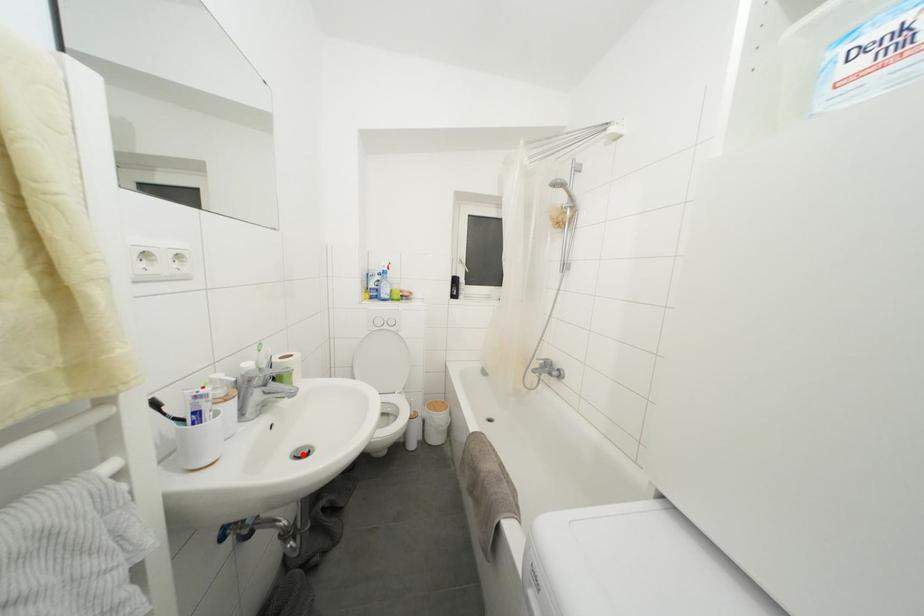
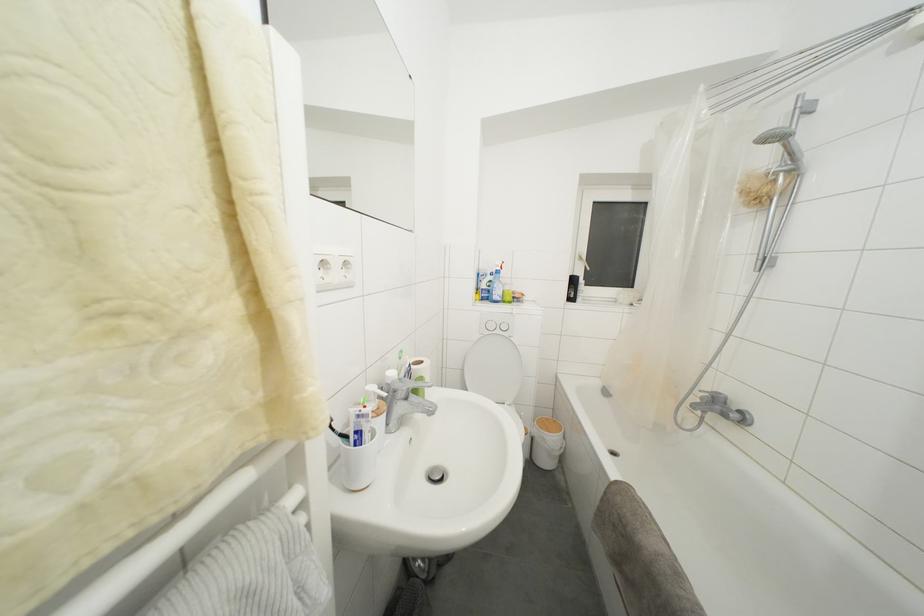
The point at the highlighted location is marked in the first image. Where is the corresponding point in the second image?

(436, 475)